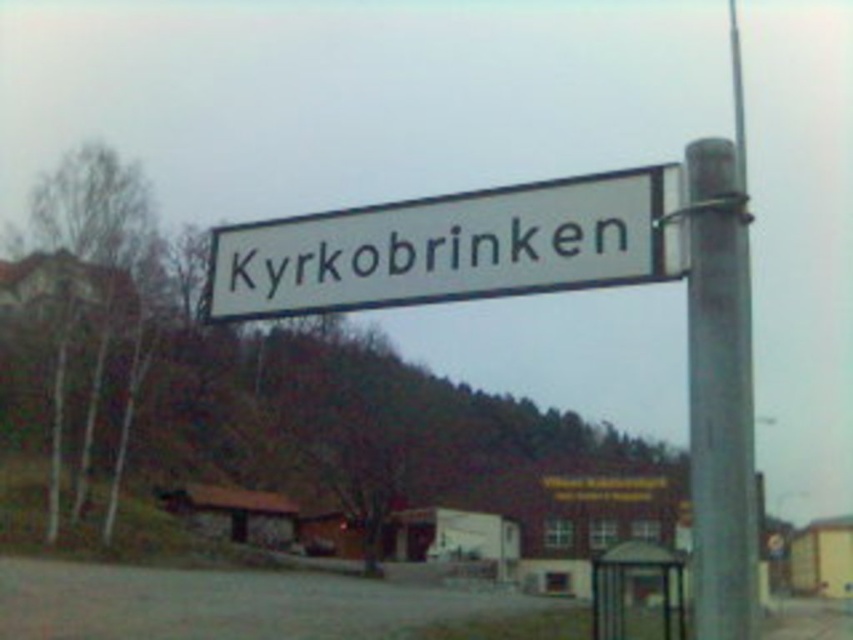
You are a pedestrian walking along the street and see the white plastic street sign at center and the metallic gray pole at right. Which object is closer to you?

The white plastic street sign at center is closer to you because the metallic gray pole at right is behind it.